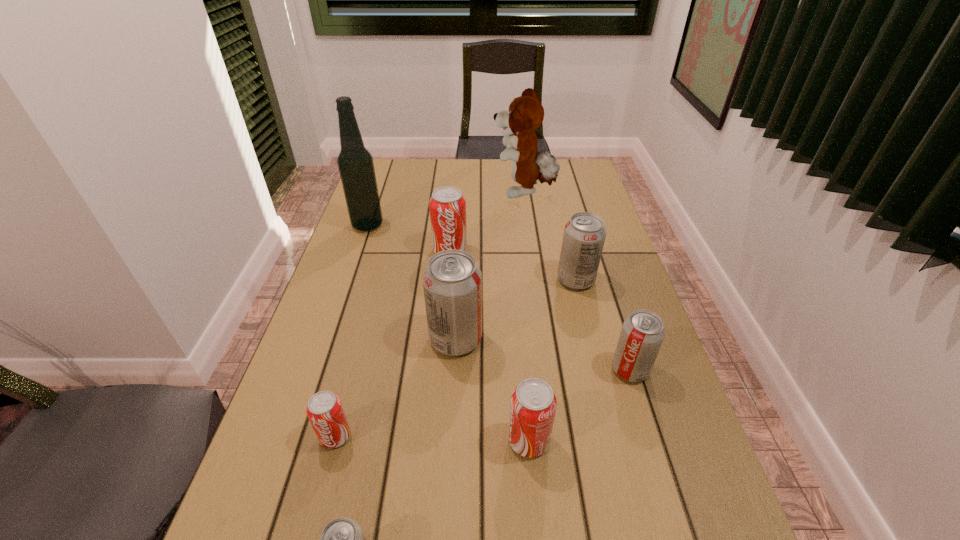
This screenshot has height=540, width=960. Find the location of `vacant area that lies between the second gray soda can from left to right and the alcohol`. vacant area that lies between the second gray soda can from left to right and the alcohol is located at coordinates (412, 282).

Identify which object is located as the fifth nearest to the smallest red soda can. Please provide its 2D coordinates. Your answer should be formatted as a tuple, i.e. [(x, y)], where the tuple contains the x and y coordinates of a point satisfying the conditions above.

[(642, 334)]

You are a GUI agent. You are given a task and a screenshot of the screen. Output one action in this format:
    pyautogui.click(x=<x>, y=<y>)
    Task: Click on the closest object to the third smallest gray soda can
    
    Given the screenshot: What is the action you would take?
    pyautogui.click(x=642, y=334)

Identify which soda can is located as the nearest to the green alcohol. Please provide its 2D coordinates. Your answer should be formatted as a tuple, i.e. [(x, y)], where the tuple contains the x and y coordinates of a point satisfying the conditions above.

[(447, 205)]

Locate which soda can ranks fourth in proximity to the eighth nearest object. Please provide its 2D coordinates. Your answer should be formatted as a tuple, i.e. [(x, y)], where the tuple contains the x and y coordinates of a point satisfying the conditions above.

[(324, 410)]

The width and height of the screenshot is (960, 540). I want to click on gray soda can that is the closest one to the rightmost red soda can, so click(452, 282).

Locate which gray soda can is the third closest to the second smallest gray soda can. Please provide its 2D coordinates. Your answer should be formatted as a tuple, i.e. [(x, y)], where the tuple contains the x and y coordinates of a point satisfying the conditions above.

[(342, 539)]

Where is `red soda can identified as the second closest to the leftmost soda can`? The image size is (960, 540). red soda can identified as the second closest to the leftmost soda can is located at coordinates (447, 205).

This screenshot has width=960, height=540. Identify the location of red soda can that is the second closest to the rightmost red soda can. [447, 205].

Identify the location of vacant space that satisfies the following two spatial constraints: 1. on the face of the brown puppy; 2. on the right side of the second smallest gray soda can. This screenshot has width=960, height=540. (549, 369).